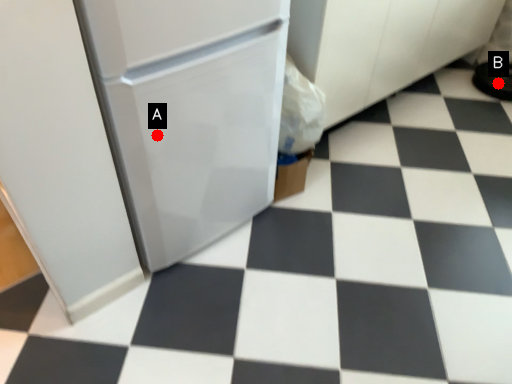
Question: Two points are circled on the image, labeled by A and B beside each circle. Which point is closer to the camera?

Choices:
 (A) A is closer
 (B) B is closer

Answer: (A)